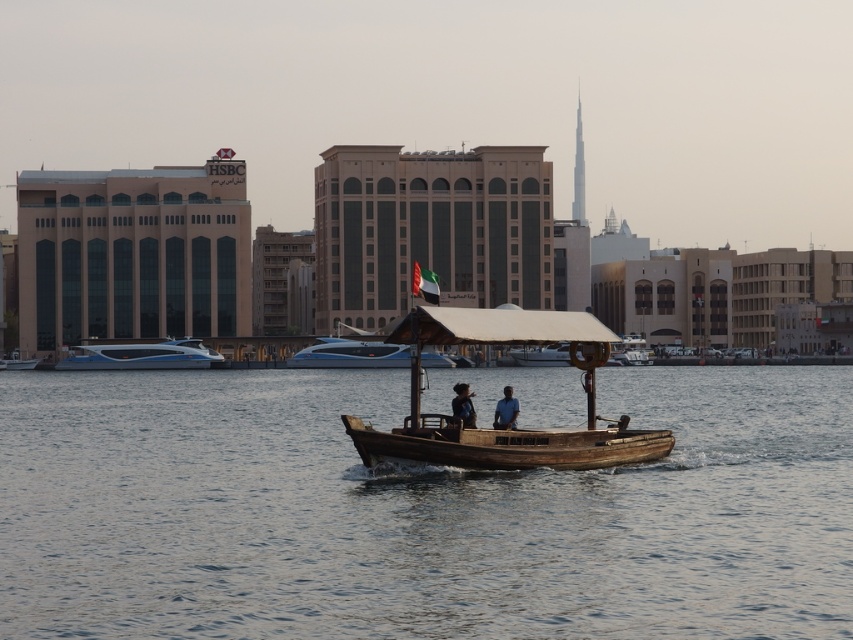
You are a passenger on the wooden boat at center and want to move to the white glossy speedboat at center. Which direction should you go to reach it?

The wooden boat at center is to the right of the white glossy speedboat at center, so you should go to the left to reach it.

You are standing at the waterfront and want to take a photo of both the traditional wooden boat and the modern ferry. The traditional wooden boat is located at point (x=585, y=312) and the modern ferry is at point (x=392, y=356). Based on their positions, which object is closer to you?

The traditional wooden boat at point (x=585, y=312) is closer to you than the modern ferry at point (x=392, y=356).

You are a photographer positioned on the shore. You want to take a photo of the wooden boat at center and the blue glossy speedboat at left. Based on their positions, which one will appear closer to the camera in the photo?

The wooden boat at center will appear closer to the camera in the photo because it is positioned in front of the blue glossy speedboat at left.